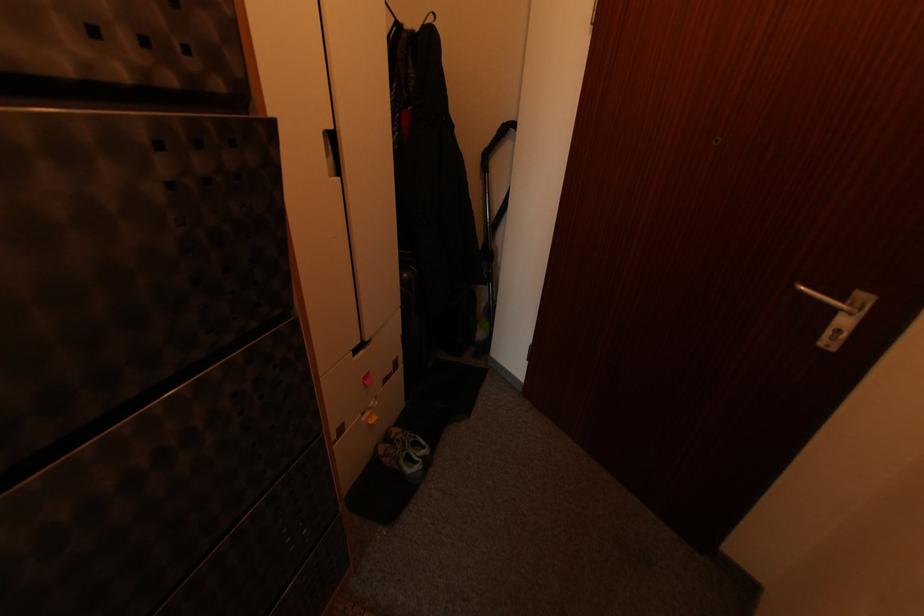
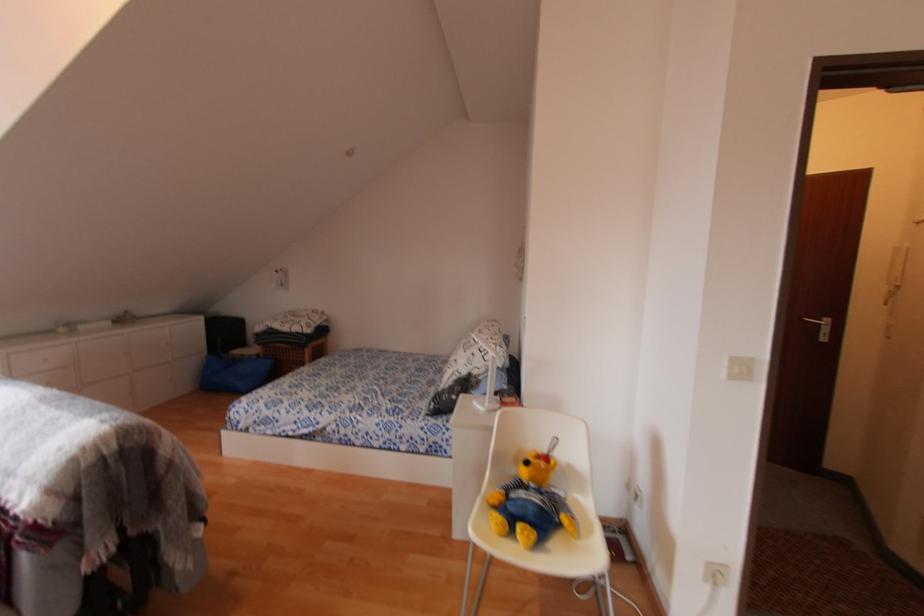
What movement of the cameraman would produce the second image?

The cameraman walked toward left, backward.